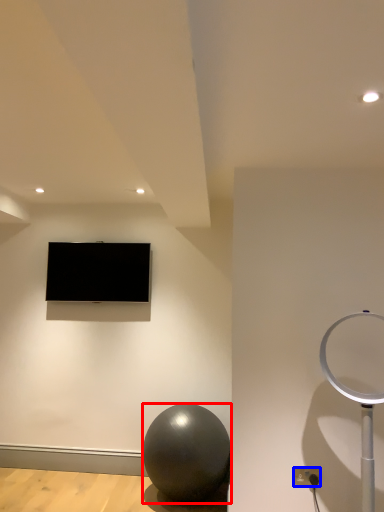
Question: Among these objects, which one is nearest to the camera, ball (highlighted by a red box) or electric outlet (highlighted by a blue box)?

Choices:
 (A) ball
 (B) electric outlet

Answer: (B)